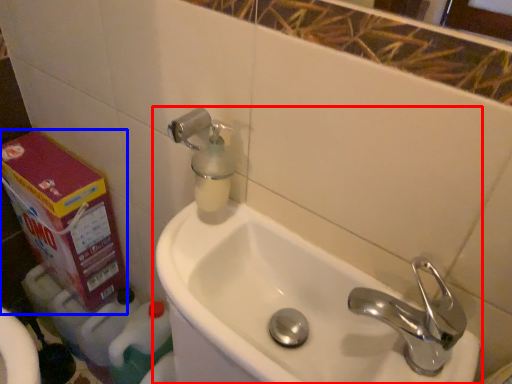
Question: Among these objects, which one is nearest to the camera, sink (highlighted by a red box) or carton (highlighted by a blue box)?

Choices:
 (A) sink
 (B) carton

Answer: (A)